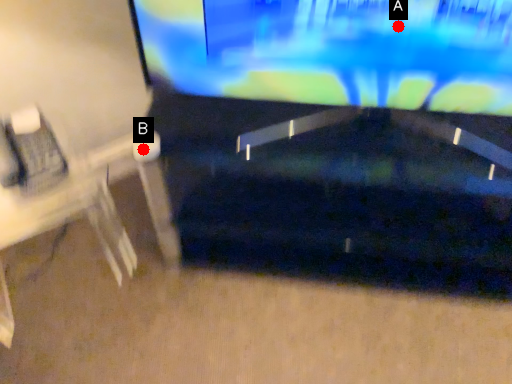
Question: Two points are circled on the image, labeled by A and B beside each circle. Among these points, which one is nearest to the camera?

Choices:
 (A) A is closer
 (B) B is closer

Answer: (A)